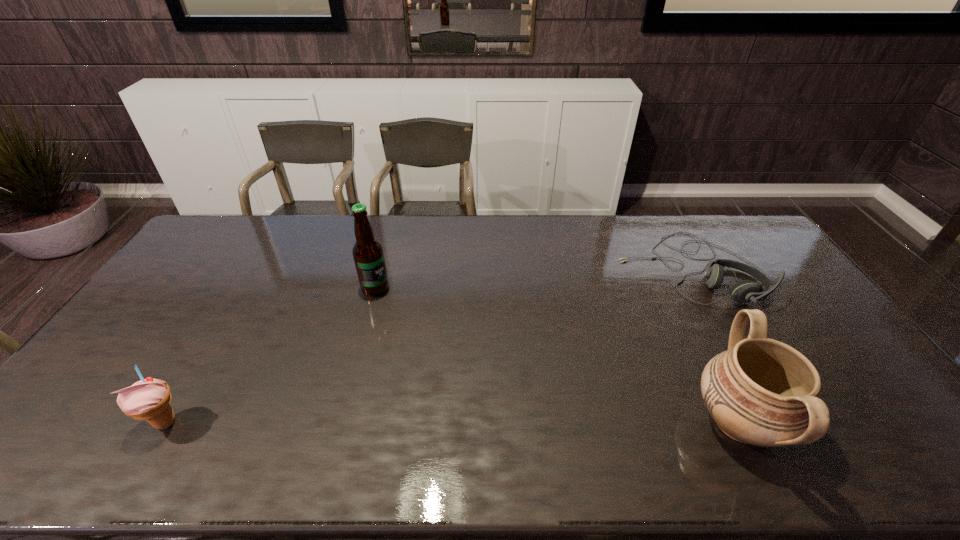
Identify the location of free space on the desktop that is between the icecream and the third shortest object and is positioned on the outer surface of the shortest object. (485, 422).

Locate an element on the screen. Image resolution: width=960 pixels, height=540 pixels. free spot on the desktop that is between the icecream and the third shortest object and is positioned on the label of the third object from right to left is located at coordinates (512, 422).